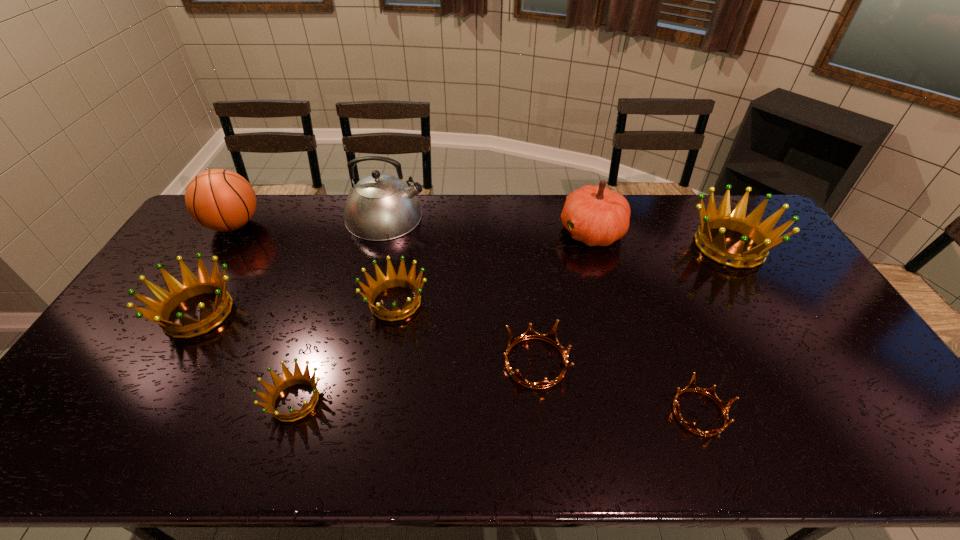
Where is `crown that is the closest to the tallest crown`? This screenshot has height=540, width=960. crown that is the closest to the tallest crown is located at coordinates (710, 392).

The image size is (960, 540). Identify the location of the second closest golden crown relative to the fourth shortest crown. (160, 310).

Locate which golden crown ranks third in proximity to the fifth shortest object. Please provide its 2D coordinates. Your answer should be formatted as a tuple, i.e. [(x, y)], where the tuple contains the x and y coordinates of a point satisfying the conditions above.

[(760, 233)]

At what (x,y) coordinates should I click in order to perform the action: click on free space that satisfies the following two spatial constraints: 1. on the back side of the rightmost golden crown; 2. from the spout of the kettle. Please return your answer as a coordinate pair (x, y). This screenshot has width=960, height=540. Looking at the image, I should click on (712, 217).

Where is `vacant point that satisfies the following two spatial constraints: 1. on the back side of the right gold crown; 2. from the spout of the kettle`? Image resolution: width=960 pixels, height=540 pixels. vacant point that satisfies the following two spatial constraints: 1. on the back side of the right gold crown; 2. from the spout of the kettle is located at coordinates (625, 217).

Locate an element on the screen. Image resolution: width=960 pixels, height=540 pixels. free space that satisfies the following two spatial constraints: 1. from the spout of the third crown from left to right; 2. on the left side of the kettle is located at coordinates (365, 302).

This screenshot has width=960, height=540. In order to click on vacant region that satisfies the following two spatial constraints: 1. from the spout of the smaller gold crown; 2. on the right side of the kettle in this screenshot , I will do `click(337, 413)`.

This screenshot has height=540, width=960. I want to click on blank space that satisfies the following two spatial constraints: 1. on the back side of the smaller gold crown; 2. on the front-facing side of the pumpkin, so click(x=631, y=232).

Identify the location of vacant point that satisfies the following two spatial constraints: 1. on the front side of the nearest golden crown; 2. on the right side of the second crown from right to left. This screenshot has height=540, width=960. (291, 413).

Where is `free space that satisfies the following two spatial constraints: 1. on the front-facing side of the tallest crown; 2. on the left side of the pink pumpkin`? free space that satisfies the following two spatial constraints: 1. on the front-facing side of the tallest crown; 2. on the left side of the pink pumpkin is located at coordinates (596, 246).